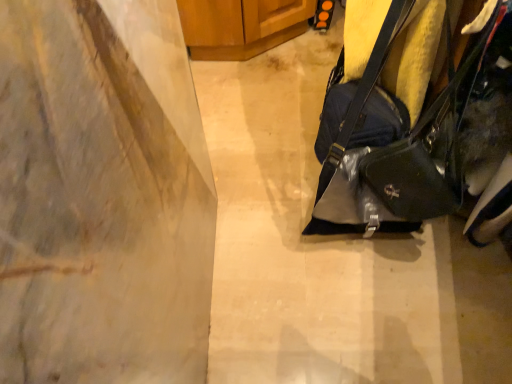
The height and width of the screenshot is (384, 512). What do you see at coordinates (309, 244) in the screenshot?
I see `matte gray concrete at center` at bounding box center [309, 244].

At what (x,y) coordinates should I click in order to perform the action: click on wooden cabinet at upper center. Please return your answer as a coordinate pair (x, y). Image resolution: width=512 pixels, height=384 pixels. Looking at the image, I should click on (241, 26).

The width and height of the screenshot is (512, 384). I want to click on matte gray concrete at center, so click(309, 244).

Consider the image. How far apart are wooden cabinet at upper center and glossy black handbag at right?

A distance of 32.38 inches exists between wooden cabinet at upper center and glossy black handbag at right.

Considering the sizes of wooden cabinet at upper center and glossy black handbag at right in the image, is wooden cabinet at upper center wider or thinner than glossy black handbag at right?

Considering their sizes, wooden cabinet at upper center looks broader than glossy black handbag at right.

Considering the positions of objects wooden cabinet at upper center and glossy black handbag at right in the image provided, who is more to the left, wooden cabinet at upper center or glossy black handbag at right?

wooden cabinet at upper center is more to the left.

Does wooden cabinet at upper center have a larger size compared to glossy black handbag at right?

Indeed, wooden cabinet at upper center has a larger size compared to glossy black handbag at right.

In the scene shown: Is glossy black handbag at right taller or shorter than wooden cabinet at upper center?

Clearly, glossy black handbag at right is taller compared to wooden cabinet at upper center.

Is there a large distance between glossy black handbag at right and wooden cabinet at upper center?

No, glossy black handbag at right is not far away from wooden cabinet at upper center.

Which of these two, glossy black handbag at right or wooden cabinet at upper center, is smaller?

glossy black handbag at right is smaller.

Is matte gray concrete at center wider or thinner than wooden cabinet at upper center?

In the image, matte gray concrete at center appears to be wider than wooden cabinet at upper center.

From the picture: Which object is positioned more to the left, matte gray concrete at center or wooden cabinet at upper center?

From the viewer's perspective, wooden cabinet at upper center appears more on the left side.

Considering the sizes of objects matte gray concrete at center and wooden cabinet at upper center in the image provided, who is smaller, matte gray concrete at center or wooden cabinet at upper center?

matte gray concrete at center is smaller.

Which object is further away from the camera, matte gray concrete at center or wooden cabinet at upper center?

Positioned behind is wooden cabinet at upper center.

Considering the relative positions of wooden cabinet at upper center and matte gray concrete at center in the image provided, is wooden cabinet at upper center to the right of matte gray concrete at center from the viewer's perspective?

In fact, wooden cabinet at upper center is to the left of matte gray concrete at center.

From a real-world perspective, is wooden cabinet at upper center above or below matte gray concrete at center?

wooden cabinet at upper center is situated higher than matte gray concrete at center in the real world.

From the picture: Can you see wooden cabinet at upper center touching matte gray concrete at center?

No, wooden cabinet at upper center is not with matte gray concrete at center.

From their relative heights in the image, would you say wooden cabinet at upper center is taller or shorter than matte gray concrete at center?

wooden cabinet at upper center is taller than matte gray concrete at center.

The image size is (512, 384). What are the coordinates of `concrete on the left of the glossy black handbag at right` in the screenshot? It's located at (x=309, y=244).

From a real-world perspective, relative to glossy black handbag at right, is matte gray concrete at center vertically above or below?

In terms of real-world spatial position, matte gray concrete at center is below glossy black handbag at right.

From the image's perspective, is matte gray concrete at center over glossy black handbag at right?

No, from the image's perspective, matte gray concrete at center is not over glossy black handbag at right.

Who is shorter, matte gray concrete at center or glossy black handbag at right?

matte gray concrete at center.

I want to click on handbag above the matte gray concrete at center (from a real-world perspective), so click(x=395, y=148).

Is point (470, 81) less distant than point (330, 256)?

Yes, point (470, 81) is closer to viewer.

Who is bigger, glossy black handbag at right or matte gray concrete at center?

Bigger between the two is glossy black handbag at right.

Is glossy black handbag at right completely or partially outside of matte gray concrete at center?

That's correct, glossy black handbag at right is outside of matte gray concrete at center.

This screenshot has height=384, width=512. Identify the location of handbag to the right of wooden cabinet at upper center. (395, 148).

Where is `furniture that appears on the left of glossy black handbag at right`? The image size is (512, 384). furniture that appears on the left of glossy black handbag at right is located at coordinates (241, 26).

Which object lies nearer to the anchor point matte gray concrete at center, glossy black handbag at right or wooden cabinet at upper center?

The object closer to matte gray concrete at center is glossy black handbag at right.

From the image, which object appears to be nearer to wooden cabinet at upper center, matte gray concrete at center or glossy black handbag at right?

Based on the image, matte gray concrete at center appears to be nearer to wooden cabinet at upper center.

When comparing their distances from wooden cabinet at upper center, does glossy black handbag at right or matte gray concrete at center seem closer?

matte gray concrete at center lies closer to wooden cabinet at upper center than the other object.

From the picture: Which object lies nearer to the anchor point glossy black handbag at right, wooden cabinet at upper center or matte gray concrete at center?

matte gray concrete at center lies closer to glossy black handbag at right than the other object.

From the image, which object appears to be nearer to glossy black handbag at right, matte gray concrete at center or wooden cabinet at upper center?

Based on the image, matte gray concrete at center appears to be nearer to glossy black handbag at right.

Estimate the real-world distances between objects in this image. Which object is closer to matte gray concrete at center, wooden cabinet at upper center or glossy black handbag at right?

Among the two, glossy black handbag at right is located nearer to matte gray concrete at center.

This screenshot has width=512, height=384. I want to click on concrete positioned between glossy black handbag at right and wooden cabinet at upper center from near to far, so click(x=309, y=244).